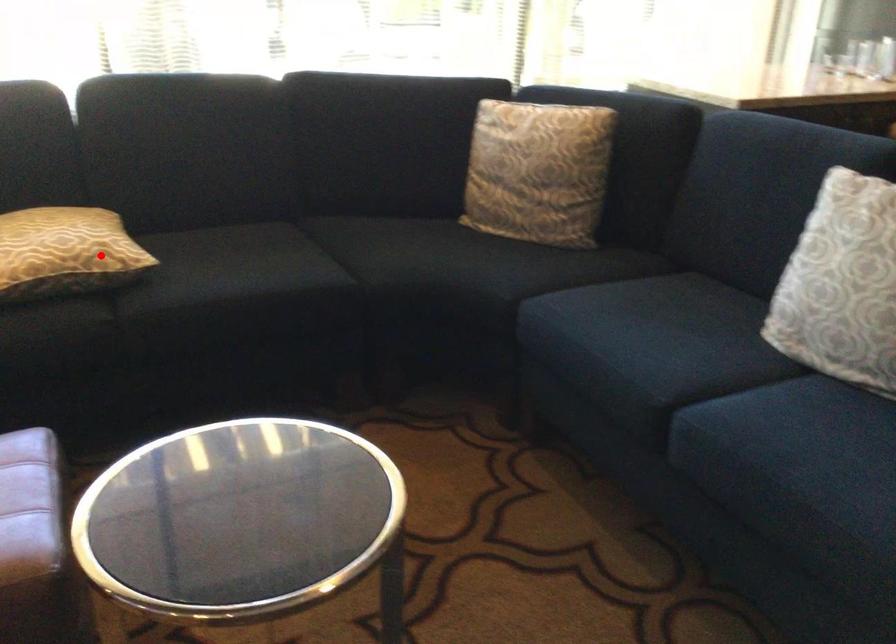
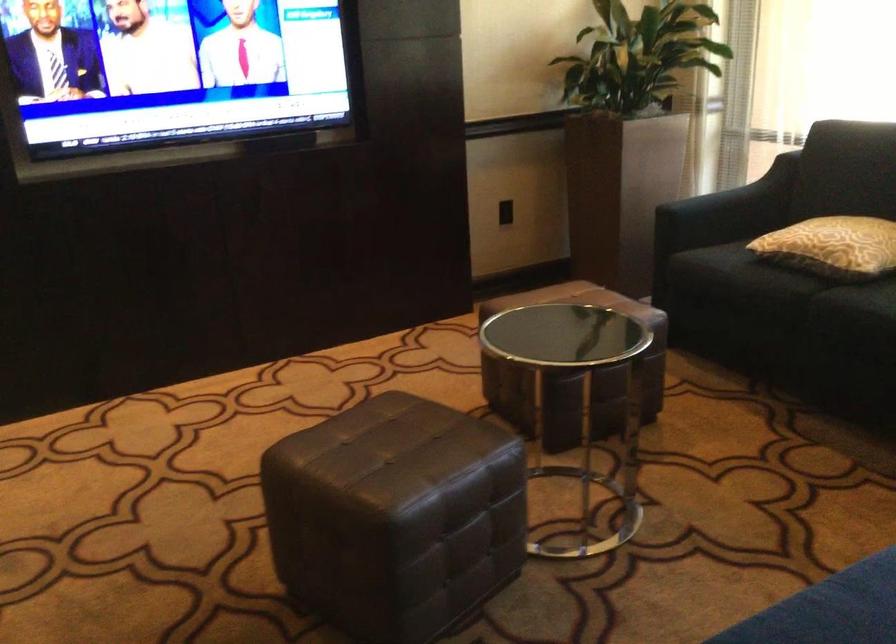
Question: A red point is marked in image1. In image2, is the corresponding 3D point closer to the camera or farther? Reply with the corresponding letter.

Choices:
 (A) The corresponding 3D point is closer.
 (B) The corresponding 3D point is farther.

Answer: (B)